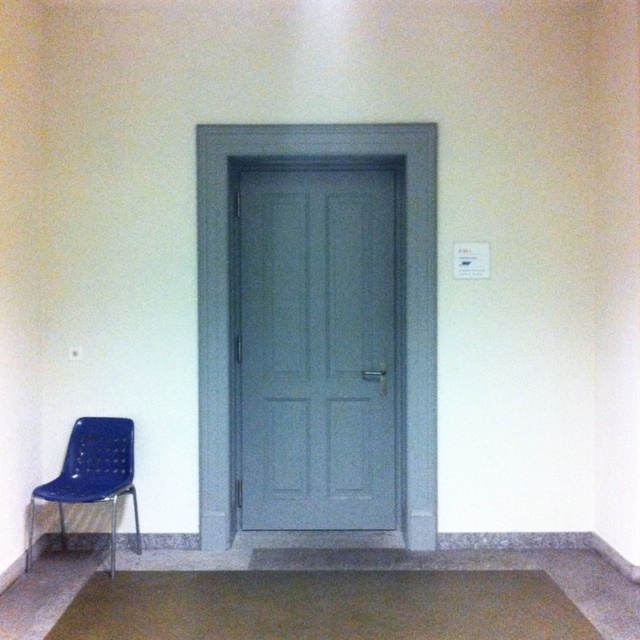
You are a delivery person trying to deliver a package to the apartment. The door needs to be opened fully to access the hallway. Considering the space available, will the matte gray door at center open without hitting the brown textured mat at lower center?

The matte gray door at center has a lesser width compared to the brown textured mat at lower center, so when opened fully, the door will not hit the mat since it is narrower than the mat.

You are standing in front of the matte gray door at center and want to place a small potted plant on the floor next to the blue plastic chair at lower left. Based on their positions, will the plant be placed to the left or right of the door?

The plant will be placed to the left of the matte gray door at center because the blue plastic chair at lower left is positioned to the left side of the door.

You are standing in front of the scene described. You need to locate the matte gray door at center. What are its coordinates?

The matte gray door at center is located at coordinates point (x=316, y=348).